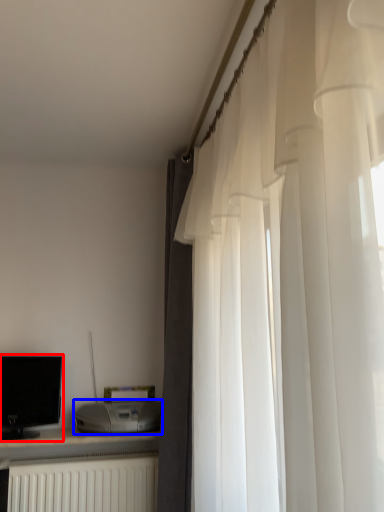
Question: Which object is closer to the camera taking this photo, computer monitor (highlighted by a red box) or appliance (highlighted by a blue box)?

Choices:
 (A) computer monitor
 (B) appliance

Answer: (B)